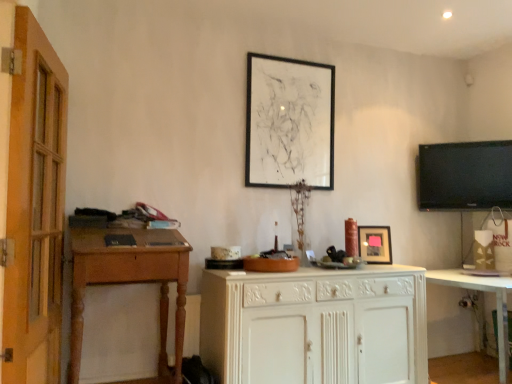
Question: From the image's perspective, is black glossy tv at upper right above or below white glossy cabinet at lower right?

Choices:
 (A) above
 (B) below

Answer: (A)

Question: Is black glossy tv at upper right bigger or smaller than white glossy cabinet at lower right?

Choices:
 (A) small
 (B) big

Answer: (A)

Question: Which is nearer to the black matte picture frame at upper center, which is the 2th picture frame from bottom to top?

Choices:
 (A) matte black picture frame at center, the 1th picture frame from the right
 (B) white painted wood cabinet at center
 (C) black glossy tv at upper right
 (D) wooden desk at left
 (E) white glossy cabinet at lower right

Answer: (A)

Question: Considering the real-world distances, which object is farthest from the wooden desk at left?

Choices:
 (A) white painted wood cabinet at center
 (B) white glossy cabinet at lower right
 (C) black matte picture frame at upper center, which is the 2th picture frame from bottom to top
 (D) black glossy tv at upper right
 (E) matte black picture frame at center, which is counted as the first picture frame, starting from the bottom

Answer: (D)